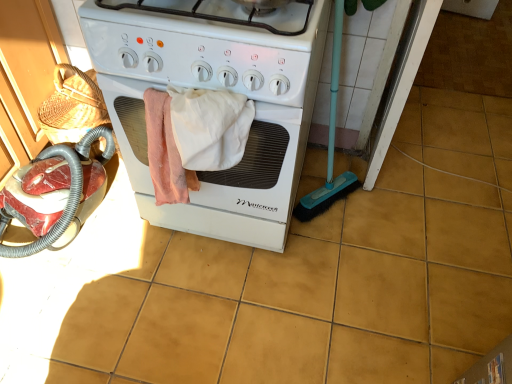
The width and height of the screenshot is (512, 384). In order to click on empty space that is ontop of yellow matte tile at center (from a real-world perspective) in this screenshot , I will do `click(481, 180)`.